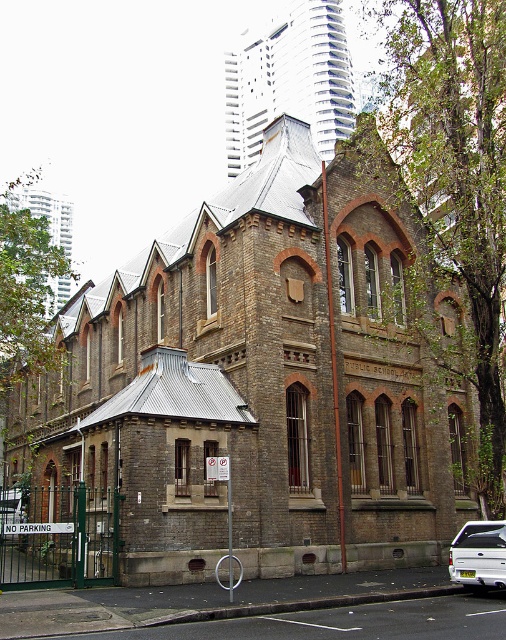
You are standing in front of a historic Victorian building and notice two brown brick structures. One is labeled as the brown brick church at center and the other as the brick church at upper center. According to their positions, which one is located to the left?

The brown brick church at center is positioned to the left of the brick church at upper center, so the brown brick church at center is the one located to the left.

You are standing in front of the historic Victorian building and need to locate the brick church at upper center. According to the coordinates provided, where exactly is the brick church positioned on the image?

The brick church at upper center is located at point [288,80], which means it is positioned slightly to the left and halfway up the vertical axis of the image.

You are a delivery driver who needs to park your white matte pickup truck at lower right as close as possible to the brown brick church at center without blocking the entrance. The minimum safe distance required between the truck and any building is 5 meters. Can you park your truck within the required distance?

The brown brick church at center is 26.38 meters from the white matte pickup truck at lower right. Since the minimum safe distance is 5 meters, the truck can be parked closer than 26.38 meters while maintaining the 5 meter requirement. Therefore, yes, the truck can be parked within the required distance as long as it stays at least 5 meters away from the church.